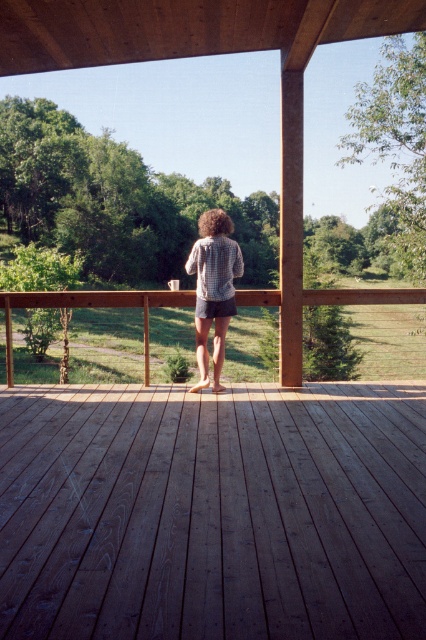
Does plaid shirt at center have a greater height compared to denim shorts at center?

Yes.

Who is taller, plaid shirt at center or denim shorts at center?

With more height is plaid shirt at center.

Where is `plaid shirt at center`? plaid shirt at center is located at coordinates (213, 289).

Between wooden porch at center and denim shorts at center, which one is positioned higher?

wooden porch at center is above.

Between point (9, 362) and point (201, 310), which one is positioned in front?

Positioned in front is point (201, 310).

The image size is (426, 640). Identify the location of wooden porch at center. (91, 304).

Does wooden porch at center appear under plaid shirt at center?

Incorrect, wooden porch at center is not positioned below plaid shirt at center.

Is wooden porch at center smaller than plaid shirt at center?

Actually, wooden porch at center might be larger than plaid shirt at center.

Who is more distant from viewer, (146, 378) or (195, 326)?

The point (195, 326) is more distant.

This screenshot has width=426, height=640. I want to click on wooden porch at center, so click(91, 304).